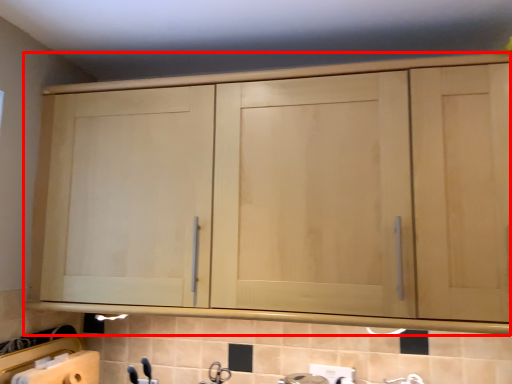
Question: From the image's perspective, what is the correct spatial relationship of cupboard (annotated by the red box) in relation to faucet?

Choices:
 (A) above
 (B) below

Answer: (A)